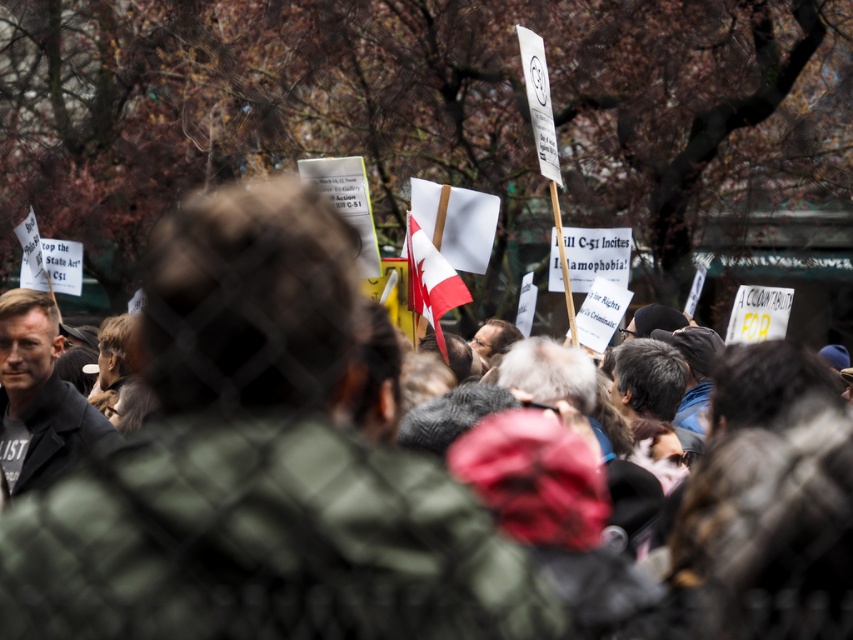
Does red and white fabric flag at center appear on the right side of white paper flag at upper left?

Indeed, red and white fabric flag at center is positioned on the right side of white paper flag at upper left.

Does point (422, 252) lie behind point (48, 280)?

No.

The width and height of the screenshot is (853, 640). I want to click on red and white fabric flag at center, so click(430, 282).